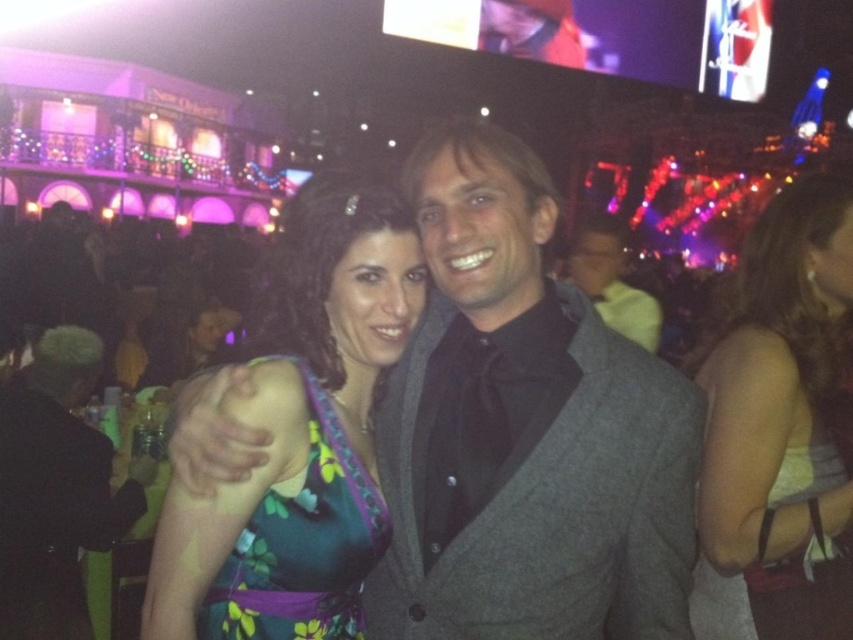
Question: Is light brown fabric dress at right bigger than black satin suit at center?

Choices:
 (A) no
 (B) yes

Answer: (A)

Question: Which object appears closest to the camera in this image?

Choices:
 (A) gray wool suit at center
 (B) matte gray suit at center
 (C) light brown fabric dress at right
 (D) green floral dress at center

Answer: (D)

Question: Which object is closer to the camera taking this photo?

Choices:
 (A) black satin suit at center
 (B) light brown fabric dress at right
 (C) matte gray suit at center

Answer: (A)

Question: Is floral dress at center wider than black satin suit at center?

Choices:
 (A) no
 (B) yes

Answer: (A)

Question: From the image, what is the correct spatial relationship of light brown fabric dress at right in relation to green floral dress at center?

Choices:
 (A) right
 (B) left

Answer: (A)

Question: Which point is farther from the camera taking this photo?

Choices:
 (A) (405, 227)
 (B) (831, 202)
 (C) (572, 515)
 (D) (27, 531)

Answer: (A)